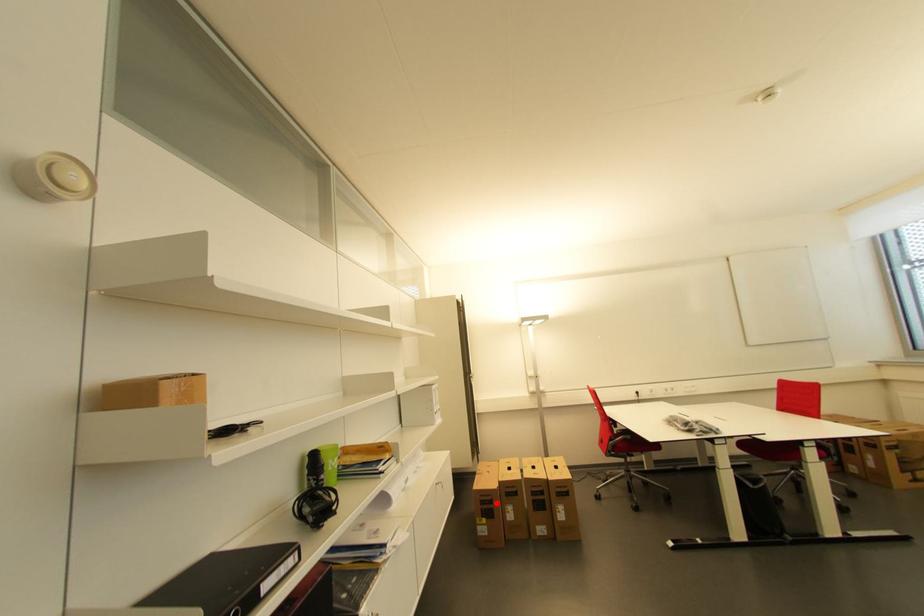
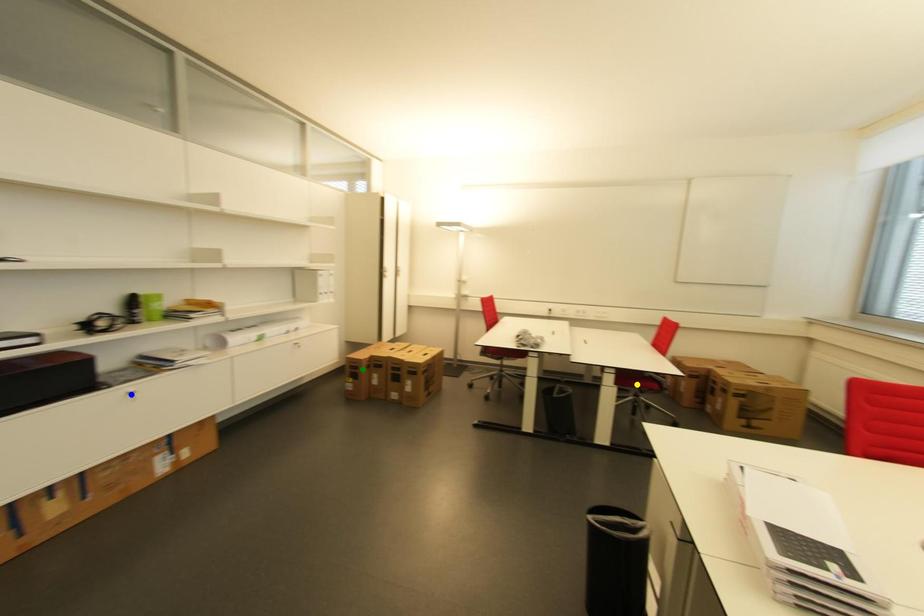
Question: I am providing you with two images of the same scene from different viewpoints. A red point is marked on the first image. You are given multiple points on the second image. Which point in image 2 is actually the same real-world point as the red point in image 1?

Choices:
 (A) blue point
 (B) green point
 (C) yellow point

Answer: (B)